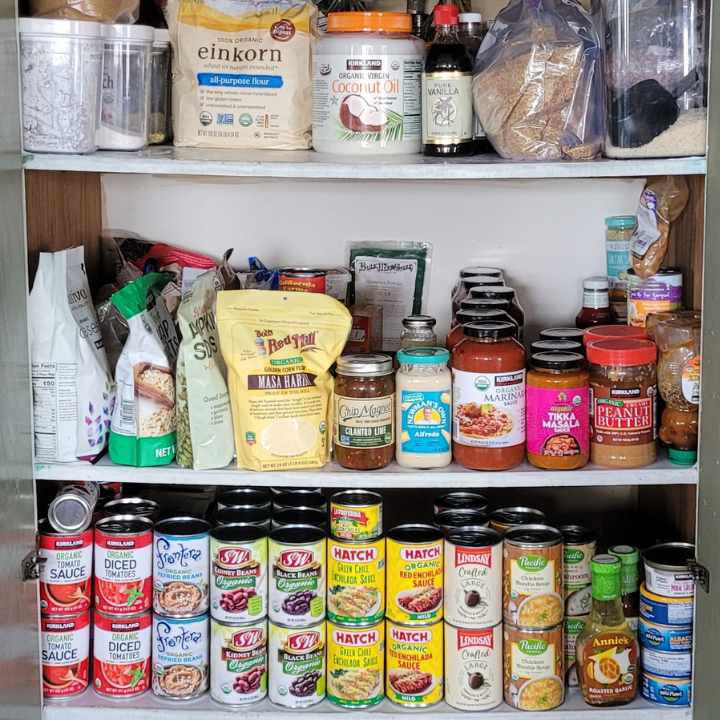
Locate an element on the screen. The width and height of the screenshot is (720, 720). 6 jars is located at coordinates (497, 384), (481, 310), (480, 301), (485, 297), (476, 282), (476, 274).